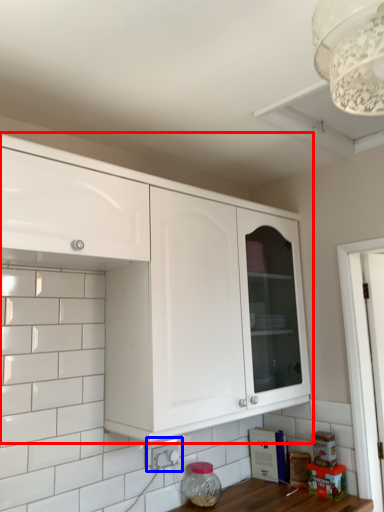
Question: Which object appears closest to the camera in this image, cabinetry (highlighted by a red box) or electric outlet (highlighted by a blue box)?

Choices:
 (A) cabinetry
 (B) electric outlet

Answer: (A)